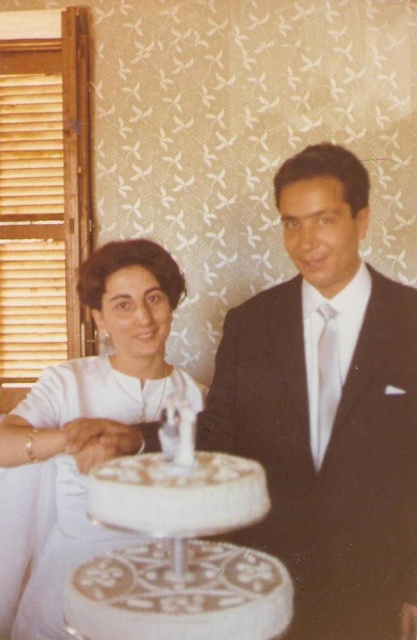
Question: Which of the following is the closest to the observer?

Choices:
 (A) white frosted cake at center
 (B) white satin dress at center
 (C) shiny black suit at center

Answer: (A)

Question: Among these points, which one is farthest from the camera?

Choices:
 (A) (401, 570)
 (B) (102, 326)

Answer: (B)

Question: From the image, what is the correct spatial relationship of shiny black suit at center in relation to white frosted cake at center?

Choices:
 (A) right
 (B) left

Answer: (A)

Question: Is shiny black suit at center above white frosted cake at center?

Choices:
 (A) no
 (B) yes

Answer: (B)

Question: Which object is positioned farthest from the white frosted cake at center?

Choices:
 (A) white satin dress at center
 (B) shiny black suit at center

Answer: (B)

Question: Does shiny black suit at center have a smaller size compared to white frosted cake at center?

Choices:
 (A) yes
 (B) no

Answer: (B)